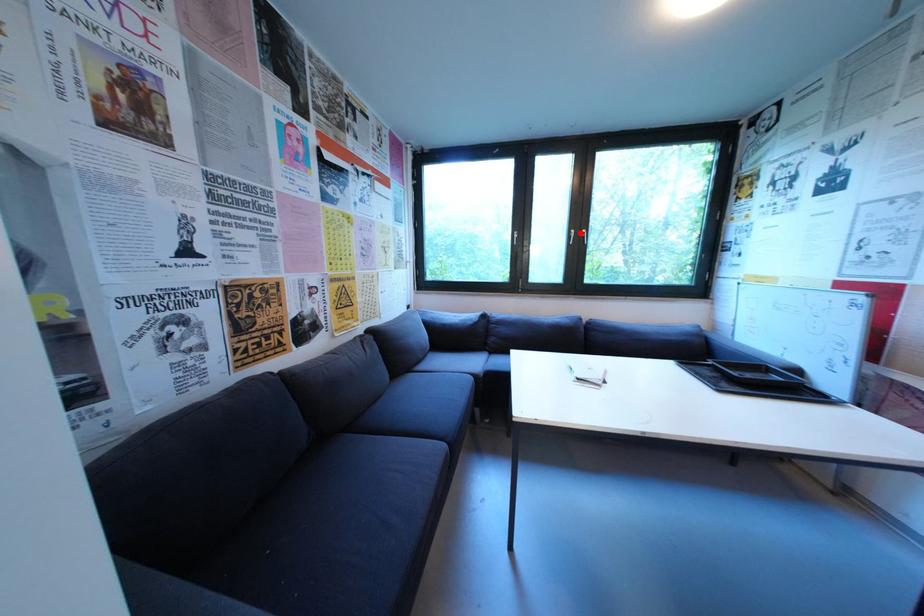
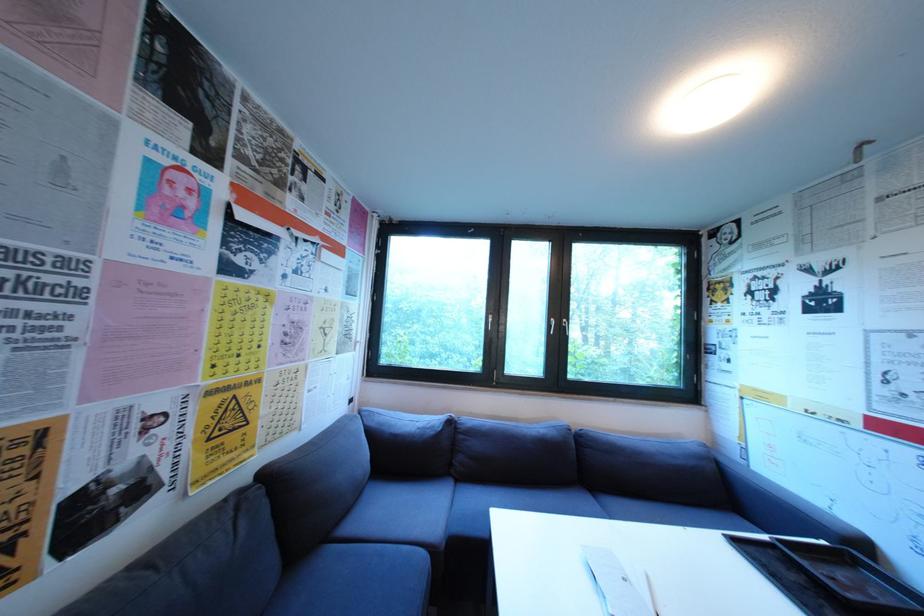
In the second image, find the point that corresponds to the highlighted location in the first image.

(560, 322)